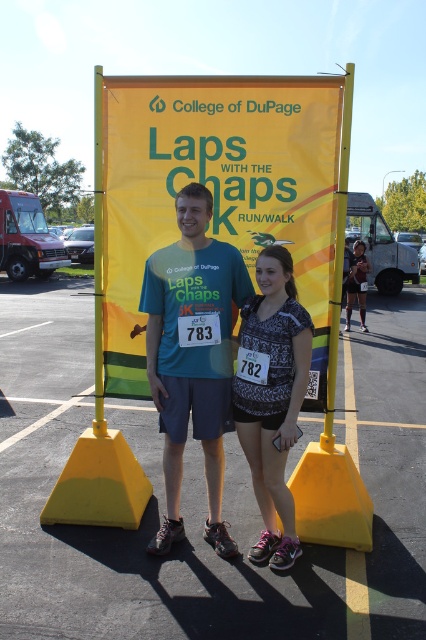
Which is behind, point (155, 336) or point (264, 452)?

The point (155, 336) is more distant.

Between teal fabric shirt at center and patterned fabric shorts at center, which one has more height?

Standing taller between the two is teal fabric shirt at center.

Who is more forward, (224, 276) or (255, 422)?

Point (255, 422) is more forward.

Identify the location of teal fabric shirt at center. (192, 356).

Is yellow fabric banner at center positioned before teal fabric shirt at center?

Yes, it is in front of teal fabric shirt at center.

Between yellow fabric banner at center and teal fabric shirt at center, which one appears on the right side from the viewer's perspective?

yellow fabric banner at center

Identify the location of yellow fabric banner at center. (221, 193).

Is teal fabric shirt at center bigger than matte black tank top at center?

No.

Describe the element at coordinates (192, 356) in the screenshot. I see `teal fabric shirt at center` at that location.

Identify the location of teal fabric shirt at center. (192, 356).